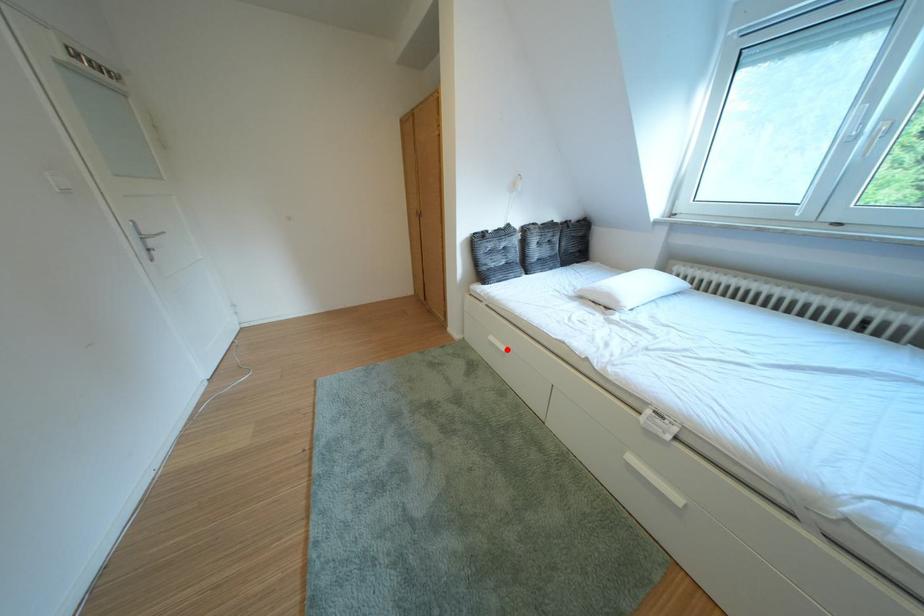
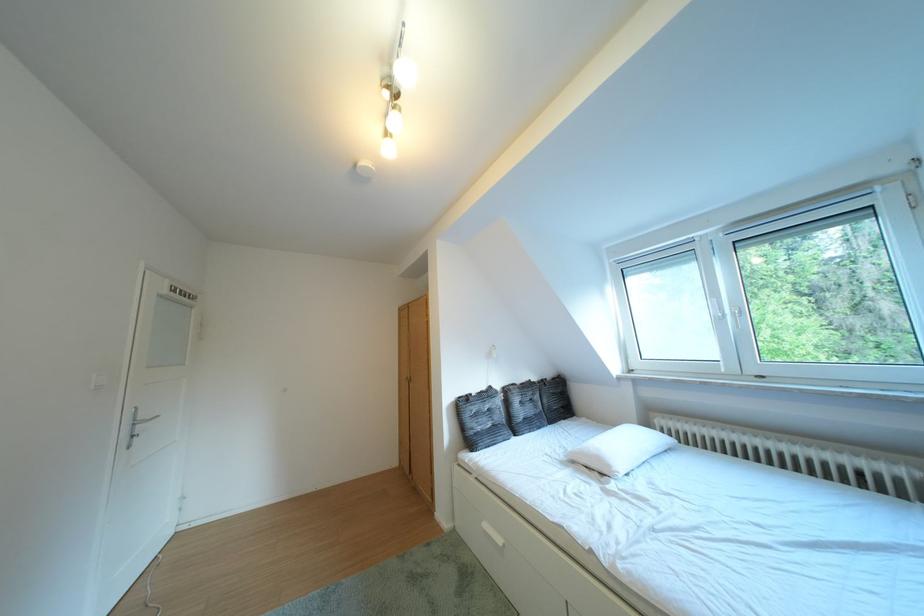
In the second image, find the point that corresponds to the highlighted location in the first image.

(503, 541)